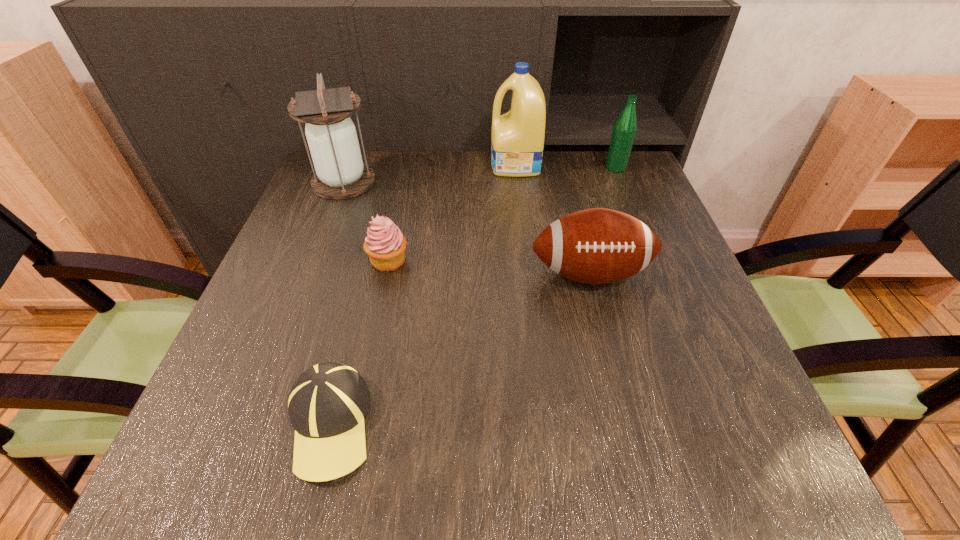
Find the location of `detergent`. detergent is located at coordinates (517, 142).

Identify the location of lantern. The height and width of the screenshot is (540, 960). (340, 173).

Locate an element on the screen. The height and width of the screenshot is (540, 960). the fourth shortest object is located at coordinates (625, 127).

Where is `football`? football is located at coordinates [596, 246].

Locate an element on the screen. The image size is (960, 540). cupcake is located at coordinates (385, 245).

The height and width of the screenshot is (540, 960). I want to click on the shortest object, so click(327, 404).

Locate an element on the screen. This screenshot has height=540, width=960. baseball cap is located at coordinates (327, 404).

Locate an element on the screen. This screenshot has width=960, height=540. vacant space located on the label of the detergent is located at coordinates (358, 165).

Find the location of a particular element. This screenshot has height=540, width=960. vacant space located on the label of the detergent is located at coordinates (376, 165).

Identify the location of free point located on the label of the detergent. The image size is (960, 540). (463, 165).